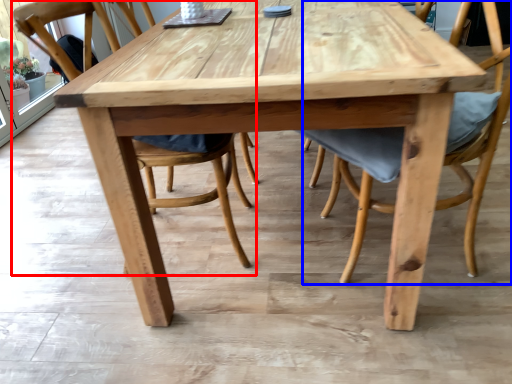
Question: Which object is closer to the camera taking this photo, chair (highlighted by a red box) or chair (highlighted by a blue box)?

Choices:
 (A) chair
 (B) chair

Answer: (B)